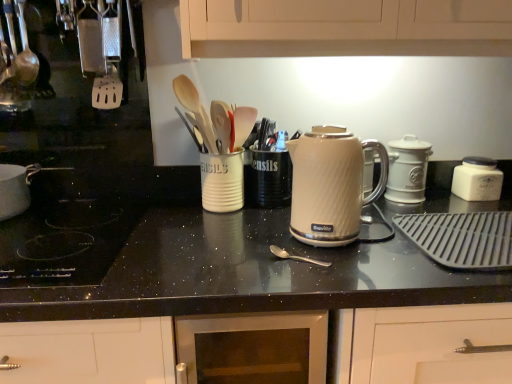
Where is `free spot to the left of white ceramic container at right, arranged as the 3th kitchen appliance when viewed from the front`? The image size is (512, 384). free spot to the left of white ceramic container at right, arranged as the 3th kitchen appliance when viewed from the front is located at coordinates (437, 199).